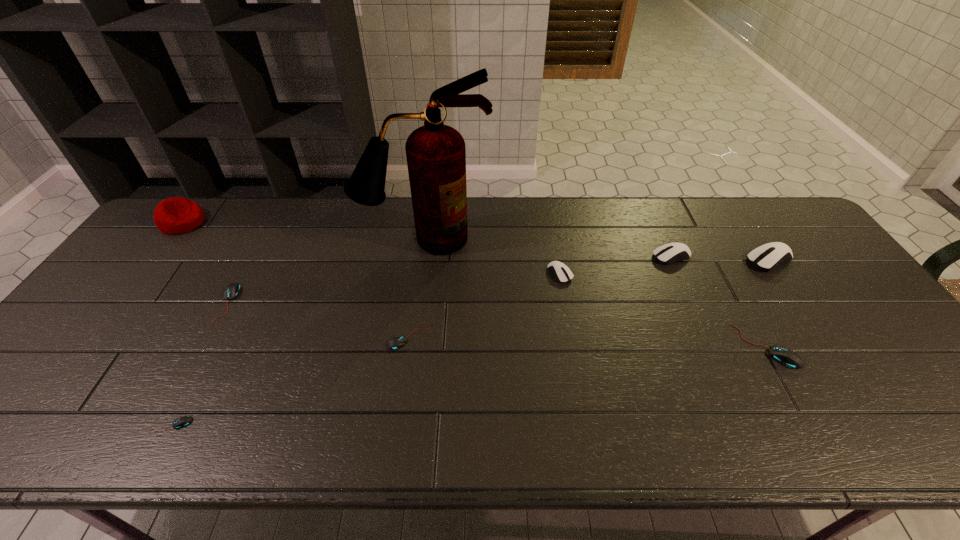
Find the location of a particular element. The image size is (960, 540). white mouse that stands as the third closest to the shortest object is located at coordinates (765, 257).

The image size is (960, 540). I want to click on white mouse that is the closest to the second biggest black mouse, so click(562, 273).

Find the location of a particular element. The height and width of the screenshot is (540, 960). black mouse that is the third closest one to the seventh tallest object is located at coordinates (785, 356).

Image resolution: width=960 pixels, height=540 pixels. Identify the location of black mouse that can be found as the closest to the eighth object from left to right. (399, 340).

Locate an element on the screen. The height and width of the screenshot is (540, 960). vacant space that satisfies the following two spatial constraints: 1. on the back side of the second tallest mouse; 2. on the left side of the seventh tallest object is located at coordinates (252, 256).

Identify the location of free region that satisfies the following two spatial constraints: 1. on the back side of the third tallest object; 2. on the seat area of the leftmost object. The width and height of the screenshot is (960, 540). (743, 222).

Identify the location of free space that satisfies the following two spatial constraints: 1. on the seat area of the second tallest object; 2. on the left side of the fifth tallest mouse. The height and width of the screenshot is (540, 960). (120, 303).

At what (x,y) coordinates should I click in order to perform the action: click on vacant space that satisfies the following two spatial constraints: 1. on the seat area of the fourth object from right to left; 2. on the left side of the leftmost object. Please return your answer as a coordinate pair (x, y). This screenshot has width=960, height=540. Looking at the image, I should click on (143, 274).

Identify the location of free point that satisfies the following two spatial constraints: 1. on the back side of the smallest white mouse; 2. on the left side of the second black mouse from right to left. The image size is (960, 540). (419, 274).

At what (x,y) coordinates should I click in order to perform the action: click on vacant area that satisfies the following two spatial constraints: 1. on the back side of the rightmost object; 2. on the right side of the fourth mouse from right to left. Please return your answer as a coordinate pair (x, y). Looking at the image, I should click on (558, 260).